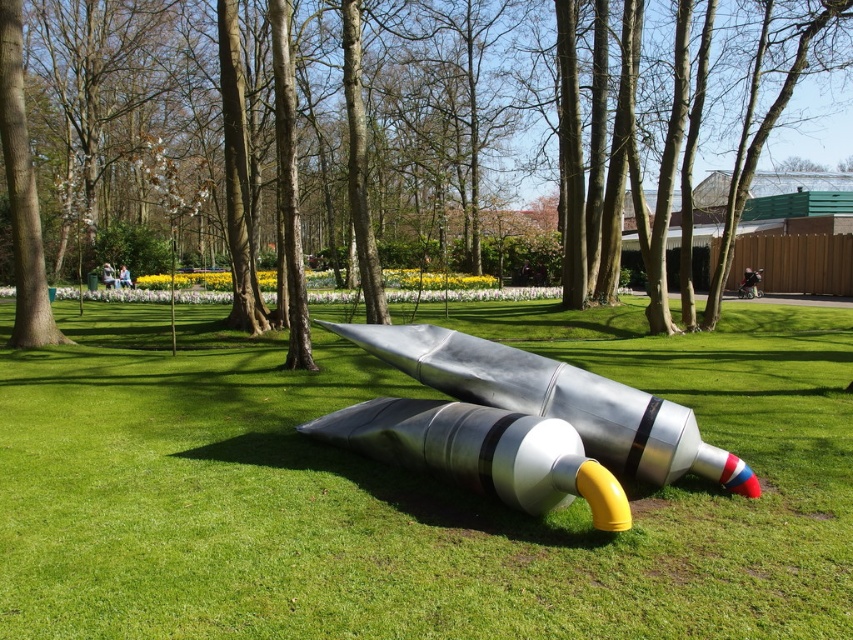
Question: Which object is the closest to the metallic grass at center?

Choices:
 (A) polished metallic rocket at center
 (B) brushed metal tree at center

Answer: (A)

Question: Which of these objects is positioned closest to the brushed metal tree at center?

Choices:
 (A) polished metallic rocket at center
 (B) metallic grass at center

Answer: (B)

Question: Is brushed metal tree at center thinner than polished metallic rocket at center?

Choices:
 (A) no
 (B) yes

Answer: (A)

Question: From the image, what is the correct spatial relationship of metallic grass at center in relation to brushed metal tree at center?

Choices:
 (A) right
 (B) left

Answer: (A)

Question: Which object is the farthest from the polished metallic rocket at center?

Choices:
 (A) metallic grass at center
 (B) brushed metal tree at center

Answer: (B)

Question: Does metallic grass at center have a smaller size compared to polished metallic rocket at center?

Choices:
 (A) no
 (B) yes

Answer: (A)